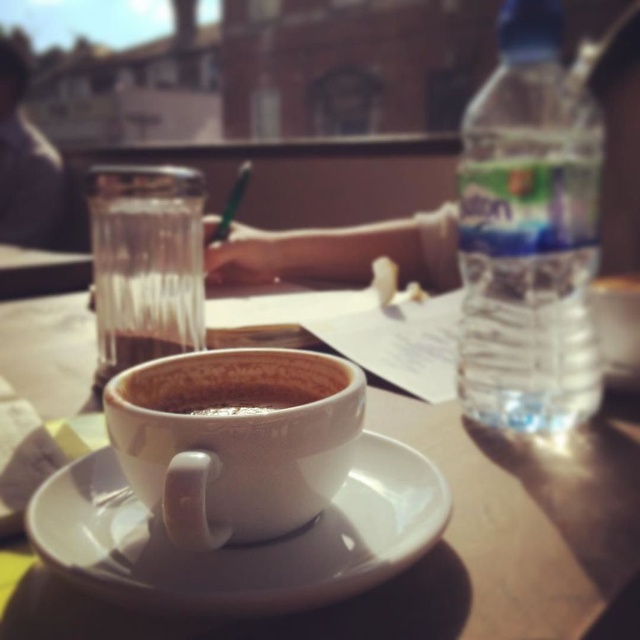
Question: Is clear plastic bottle at right to the right of white ceramic mug at center from the viewer's perspective?

Choices:
 (A) no
 (B) yes

Answer: (B)

Question: Which point appears farthest from the camera in this image?

Choices:
 (A) (86, 532)
 (B) (538, 8)

Answer: (B)

Question: From the image, what is the correct spatial relationship of white ceramic saucer at center in relation to white ceramic mug at center?

Choices:
 (A) above
 (B) below

Answer: (B)

Question: Can you confirm if white ceramic cup at center is wider than white ceramic mug at center?

Choices:
 (A) no
 (B) yes

Answer: (B)

Question: Which object is closer to the camera taking this photo?

Choices:
 (A) clear plastic bottle at right
 (B) white ceramic saucer at center

Answer: (B)

Question: Which object is farther from the camera taking this photo?

Choices:
 (A) clear glass at center
 (B) white ceramic saucer at center

Answer: (A)